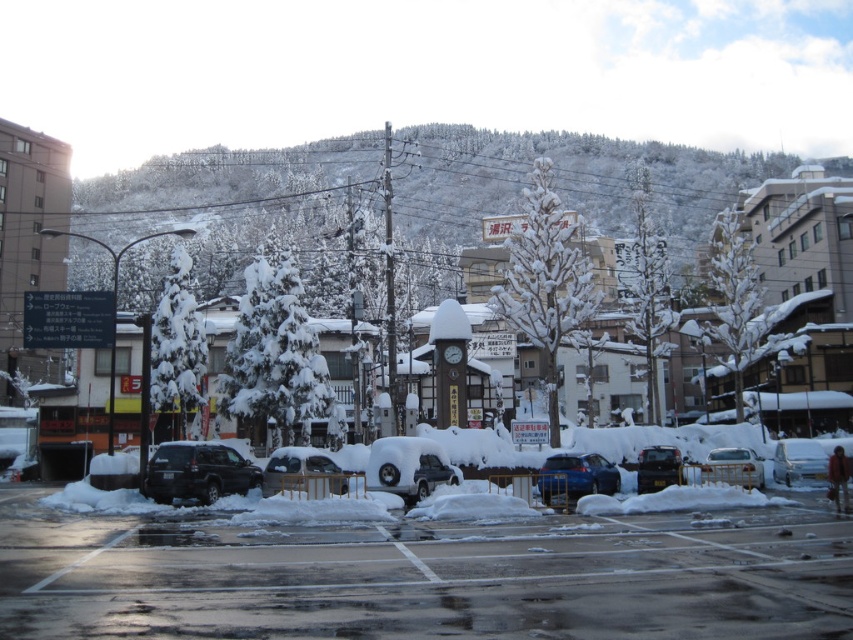
You are driving a car and want to exit the parking lot. You see a matte black suv at center and a sleek silver sedan at center. Which vehicle is blocking your path?

The sleek silver sedan at center is behind the matte black suv at center, so the matte black suv at center is blocking your path.

You are driving a car and want to park in the parking lot shown in the image. You see the metallic blue sedan at center and the white matte car at center. Which car is positioned more to the left side of the parking lot?

The metallic blue sedan at center is positioned to the left of the white matte car at center, so it is more to the left side of the parking lot.

You are a delivery driver who needs to park your truck, which is 6 meters long, between the two vehicles in the parking lot. Can you fit your truck between the matte black suv at center and the sleek silver sedan at center?

The distance between the matte black suv at center and the sleek silver sedan at center is 5.14 meters. Since your truck is 6 meters long, it cannot fit between them as the space is shorter than the truck.